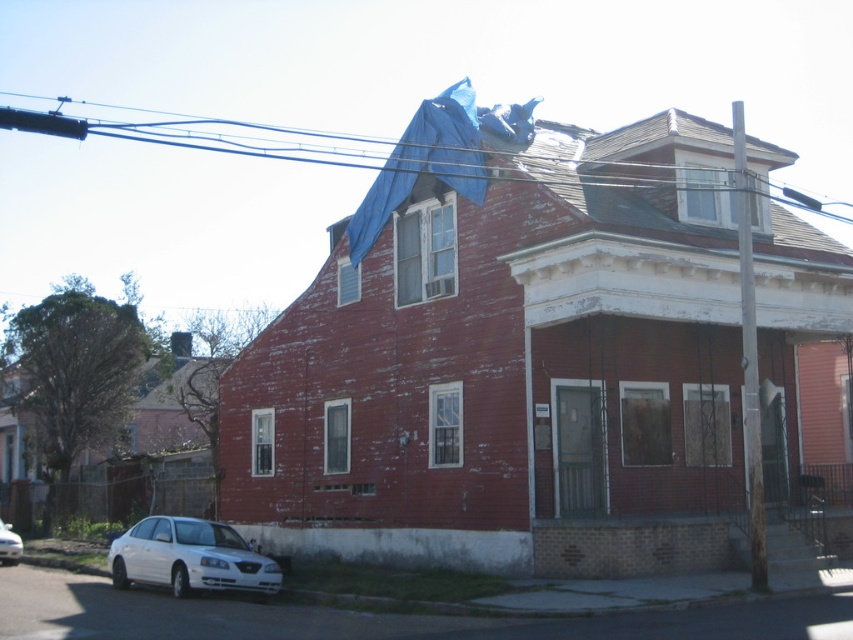
How distant is white matte sedan at lower left from white glossy sedan at lower left?

white matte sedan at lower left is 39.31 feet from white glossy sedan at lower left.

Is point (186, 593) positioned before point (13, 531)?

Yes, point (186, 593) is in front of point (13, 531).

Who is more distant from viewer, (152, 561) or (9, 563)?

Positioned behind is point (9, 563).

The width and height of the screenshot is (853, 640). I want to click on white matte sedan at lower left, so click(x=189, y=557).

Does blue plastic tarp at upper center have a smaller size compared to white matte sedan at lower left?

No.

Which is in front, point (90, 120) or point (135, 563)?

Positioned in front is point (135, 563).

Does point (184, 125) come behind point (161, 544)?

Yes.

This screenshot has height=640, width=853. I want to click on blue plastic tarp at upper center, so click(207, 134).

Between blue plastic tarp at upper center and white glossy sedan at lower left, which one has less height?

white glossy sedan at lower left is shorter.

Can you confirm if blue plastic tarp at upper center is taller than white glossy sedan at lower left?

Correct, blue plastic tarp at upper center is much taller as white glossy sedan at lower left.

Does point (231, 124) come behind point (6, 544)?

Yes.

Locate an element on the screen. The height and width of the screenshot is (640, 853). blue plastic tarp at upper center is located at coordinates (207, 134).